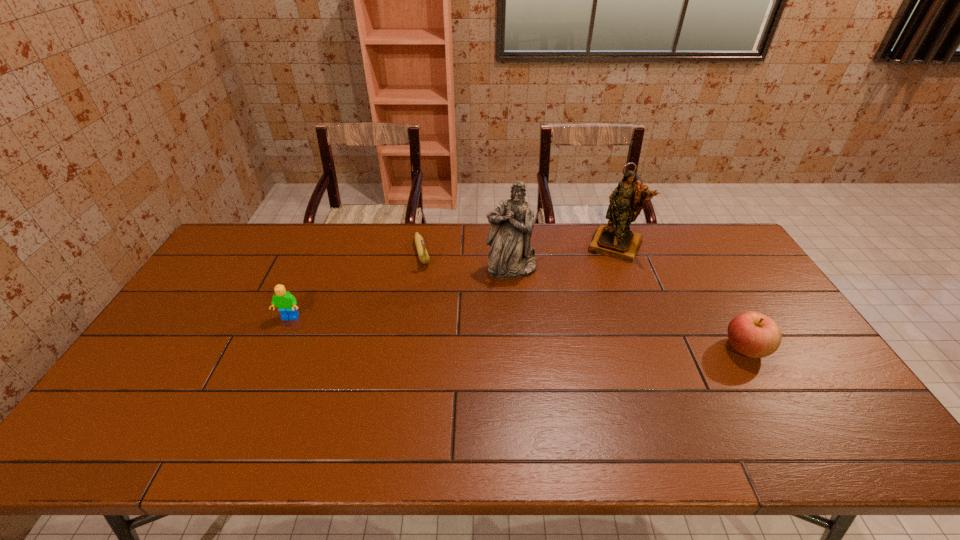
At what (x,y) coordinates should I click in order to perform the action: click on vacant space at the far edge of the desktop. Please return your answer as a coordinate pair (x, y). Image resolution: width=960 pixels, height=540 pixels. Looking at the image, I should click on (676, 262).

This screenshot has width=960, height=540. Identify the location of vacant space at the near edge. (637, 401).

The height and width of the screenshot is (540, 960). What are the coordinates of `free space at the left edge of the desktop` in the screenshot? It's located at (233, 309).

In the image, there is a desktop. Identify the location of free space at the far left corner. click(229, 253).

Where is `vacant space at the near left corner of the desktop`? This screenshot has height=540, width=960. vacant space at the near left corner of the desktop is located at coordinates (142, 408).

The height and width of the screenshot is (540, 960). I want to click on vacant region between the third object from left to right and the leftmost object, so click(x=400, y=293).

At what (x,y) coordinates should I click in order to perform the action: click on free area in between the fourth object from right to left and the nearest object. Please return your answer as a coordinate pair (x, y). The width and height of the screenshot is (960, 540). Looking at the image, I should click on (584, 301).

Find the location of `free area in between the leftmost object and the right figurine`. free area in between the leftmost object and the right figurine is located at coordinates (452, 281).

Where is `free space between the second nearest object and the fourth object from left to right`? free space between the second nearest object and the fourth object from left to right is located at coordinates (452, 281).

At what (x,y) coordinates should I click in order to perform the action: click on vacant area that lies between the right figurine and the fourth farthest object. Please return your answer as a coordinate pair (x, y). Looking at the image, I should click on (452, 281).